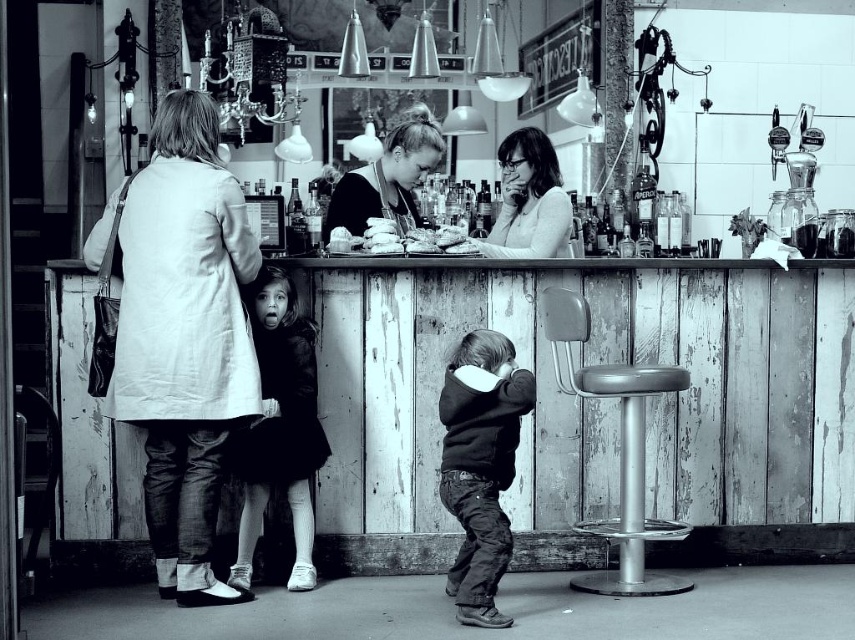
Question: Does matte black hair at center have a greater width compared to smooth white bread at center?

Choices:
 (A) yes
 (B) no

Answer: (B)

Question: Can you confirm if metallic silver stool at lower right is positioned above matte white blouse at upper center?

Choices:
 (A) no
 (B) yes

Answer: (A)

Question: Estimate the real-world distances between objects in this image. Which object is closer to the white fabric coat at left?

Choices:
 (A) dark fur coat at center
 (B) matte white blouse at upper center
 (C) smooth white bread at center

Answer: (A)

Question: Which of these objects is positioned farthest from the dark fur coat at center?

Choices:
 (A) smooth white bread at center
 (B) matte white blouse at upper center
 (C) white fabric coat at left
 (D) dark gray hoodie at center

Answer: (B)

Question: Can you confirm if metallic silver stool at lower right is positioned below smooth white bread at center?

Choices:
 (A) no
 (B) yes

Answer: (B)

Question: Which point appears closest to the camera in this image?

Choices:
 (A) (641, 436)
 (B) (410, 236)
 (C) (488, 371)
 (D) (506, 193)

Answer: (C)